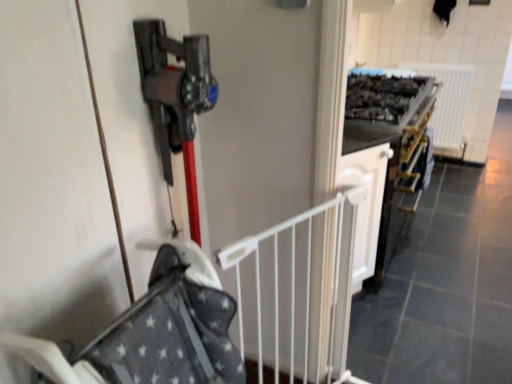
Question: Is white metal gate at center situated inside gray fabric baby carriage at center or outside?

Choices:
 (A) outside
 (B) inside

Answer: (A)

Question: Is white metal gate at center in front of or behind gray fabric baby carriage at center in the image?

Choices:
 (A) behind
 (B) front

Answer: (A)

Question: Which object is positioned closest to the gray fabric baby carriage at center?

Choices:
 (A) white plastic radiator at upper right
 (B) white glossy cabinet at center
 (C) white metal gate at center

Answer: (C)

Question: Which of these objects is positioned closest to the white plastic radiator at upper right?

Choices:
 (A) white glossy cabinet at center
 (B) gray fabric baby carriage at center
 (C) white metal gate at center

Answer: (A)